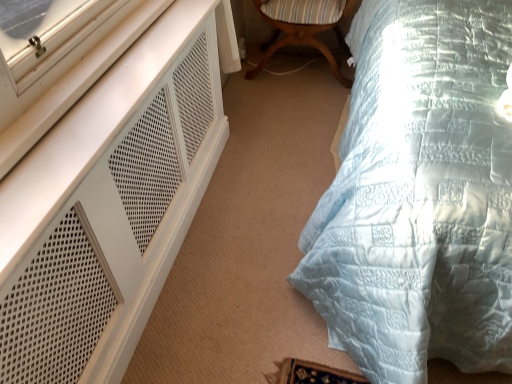
Locate an element on the screen. This screenshot has height=384, width=512. free space in front of wooden striped cushion at center is located at coordinates (288, 114).